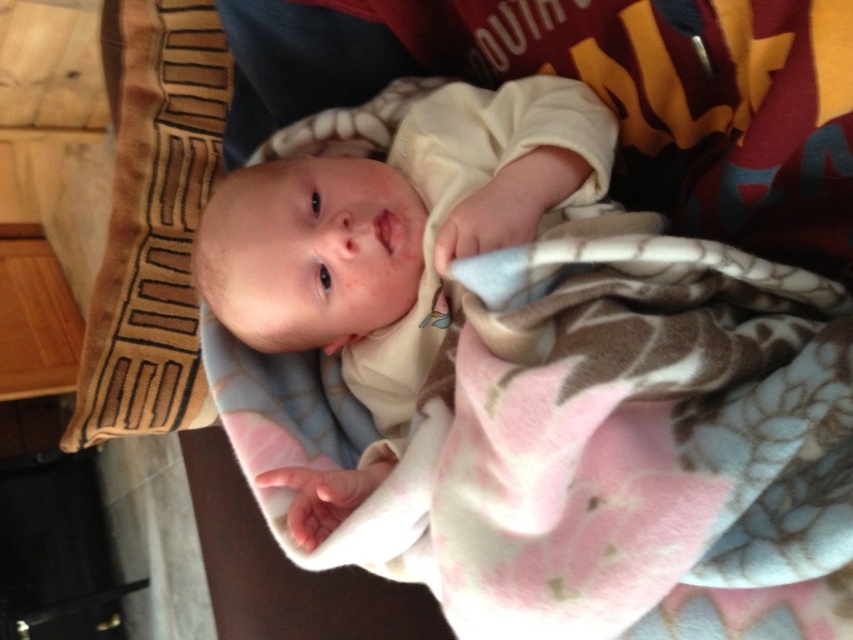
You are a photographer trying to capture the baby in the scene. The smooth beige baby at center and the brown textured pillow at left are both in the frame. Which object should you focus on if you want to capture the larger subject?

The smooth beige baby at center is bigger than the brown textured pillow at left, so you should focus on the smooth beige baby at center to capture the larger subject.

You are a delivery robot that is 12 inches wide. You need to move from the point marked as point (378,150) to the door located at the opposite side of the room. Is there enough space for you to pass through the area between the baby and the cushion with geometric pattern in earthy tones?

The distance between the baby and the cushion with geometric pattern in earthy tones is 32.98 inches, so yes, the robot can pass through since it is wider than the robot.

You are a photographer taking a picture of the smooth beige baby at center and the brown textured pillow at left. To ensure both are in frame, where should you position your camera relative to the baby?

The smooth beige baby at center is to the right of the brown textured pillow at left, so position the camera to the left of the baby to include both in the frame.